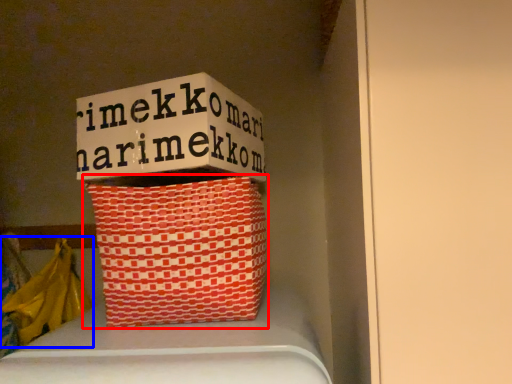
Question: Which point is closer to the camera, basket (highlighted by a red box) or material (highlighted by a blue box)?

Choices:
 (A) basket
 (B) material

Answer: (A)